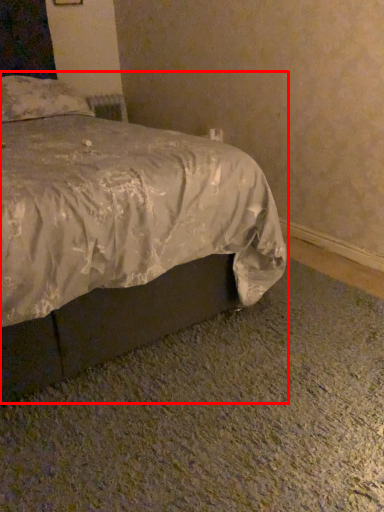
Question: Observing the image, what is the correct spatial positioning of bed (annotated by the red box) in reference to pillow?

Choices:
 (A) left
 (B) right

Answer: (B)